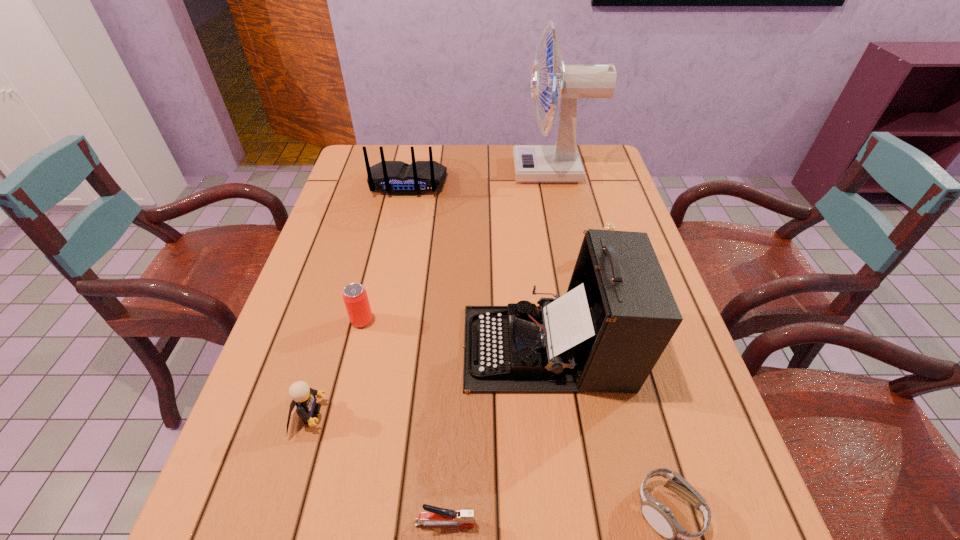
In the image, there is a desktop. At what (x,y) coordinates should I click in order to perform the action: click on vacant region at the far edge. Please return your answer as a coordinate pair (x, y). The image size is (960, 540). Looking at the image, I should click on (497, 173).

This screenshot has width=960, height=540. Identify the location of vacant space at the left edge of the desktop. (348, 248).

Image resolution: width=960 pixels, height=540 pixels. In the image, there is a desktop. In order to click on vacant space at the right edge in this screenshot , I will do `click(583, 186)`.

Identify the location of free space at the far left corner of the desktop. This screenshot has height=540, width=960. (390, 146).

Identify the location of vacant space at the near right corner of the desktop. (698, 529).

The height and width of the screenshot is (540, 960). Identify the location of free space between the sixth shortest object and the stapler. (426, 353).

Locate an element on the screen. empty space that is in between the beer can and the sixth shortest object is located at coordinates (385, 252).

Where is `free space that is in between the tallest object and the beer can`? Image resolution: width=960 pixels, height=540 pixels. free space that is in between the tallest object and the beer can is located at coordinates (458, 246).

This screenshot has width=960, height=540. Find the location of `unoccupied area between the beer can and the stapler`. unoccupied area between the beer can and the stapler is located at coordinates (403, 422).

You are a GUI agent. You are given a task and a screenshot of the screen. Output one action in this format:
    pyautogui.click(x=<x>, y=<y>)
    Task: Click on the empty space that is in between the second tallest object and the tallest object
    
    Given the screenshot: What is the action you would take?
    pyautogui.click(x=551, y=259)